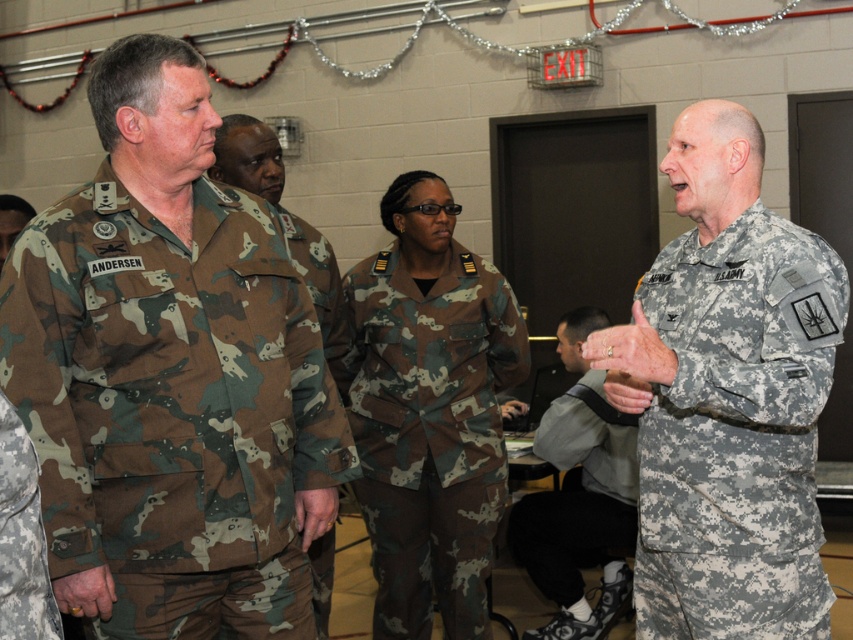
Who is positioned more to the left, camo fabric uniform at left or camouflage fabric uniform at left?

Positioned to the left is camouflage fabric uniform at left.

Who is higher up, camo fabric uniform at left or camouflage fabric uniform at left?

Positioned higher is camo fabric uniform at left.

Locate an element on the screen. This screenshot has height=640, width=853. camo fabric uniform at left is located at coordinates (170, 400).

Does camo fabric uniform at center have a lesser height compared to camo uniform at center?

No.

Is point (374, 300) less distant than point (265, 152)?

No.

Find the location of a particular element. camo fabric uniform at center is located at coordinates (428, 429).

Locate an element on the screen. This screenshot has width=853, height=640. camo fabric uniform at center is located at coordinates (428, 429).

Between point (665, 460) and point (267, 180), which one is positioned behind?

The point (267, 180) is behind.

Does camouflage fabric uniform at right lie behind camo uniform at center?

No.

Who is more distant from viewer, (776, 284) or (317, 579)?

The point (317, 579) is more distant.

At what (x,y) coordinates should I click in order to perform the action: click on camouflage fabric uniform at right. Please return your answer as a coordinate pair (x, y). This screenshot has width=853, height=640. Looking at the image, I should click on tap(737, 433).